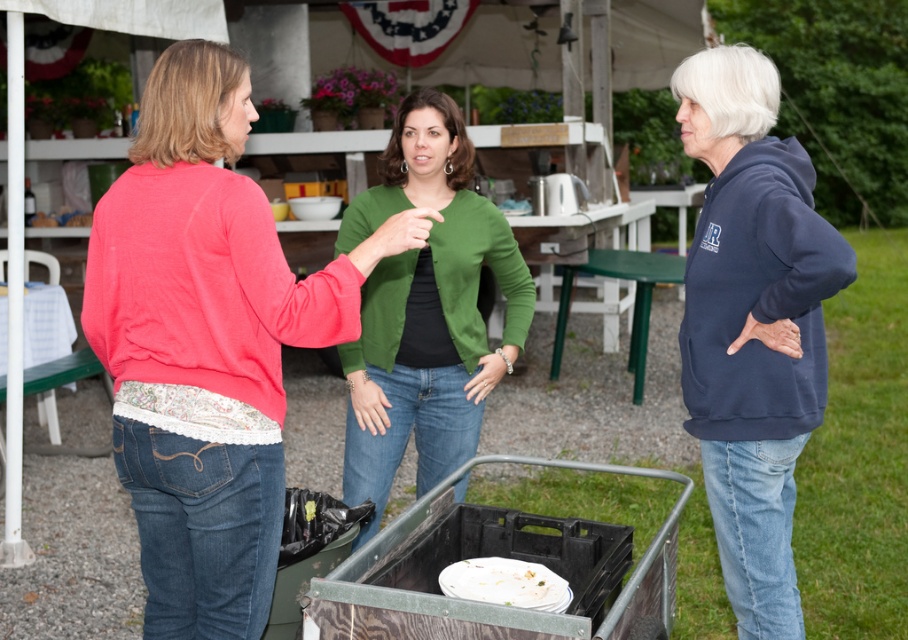
Question: Among these points, which one is farthest from the camera?

Choices:
 (A) (364, 413)
 (B) (149, 164)
 (C) (747, 518)
 (D) (500, 582)

Answer: (A)

Question: Which point is farther from the camera taking this photo?

Choices:
 (A) (489, 552)
 (B) (457, 200)
 (C) (737, 106)

Answer: (B)

Question: Which point is farther to the camera?

Choices:
 (A) (452, 424)
 (B) (170, 390)
 (C) (783, 579)

Answer: (A)

Question: Does matte pink sweater at center come in front of green matte cardigan at center?

Choices:
 (A) yes
 (B) no

Answer: (A)

Question: Can you confirm if navy blue hoodie at right is wider than metallic gray cart at lower center?

Choices:
 (A) no
 (B) yes

Answer: (A)

Question: Is matte pink sweater at center thinner than green matte cardigan at center?

Choices:
 (A) yes
 (B) no

Answer: (B)